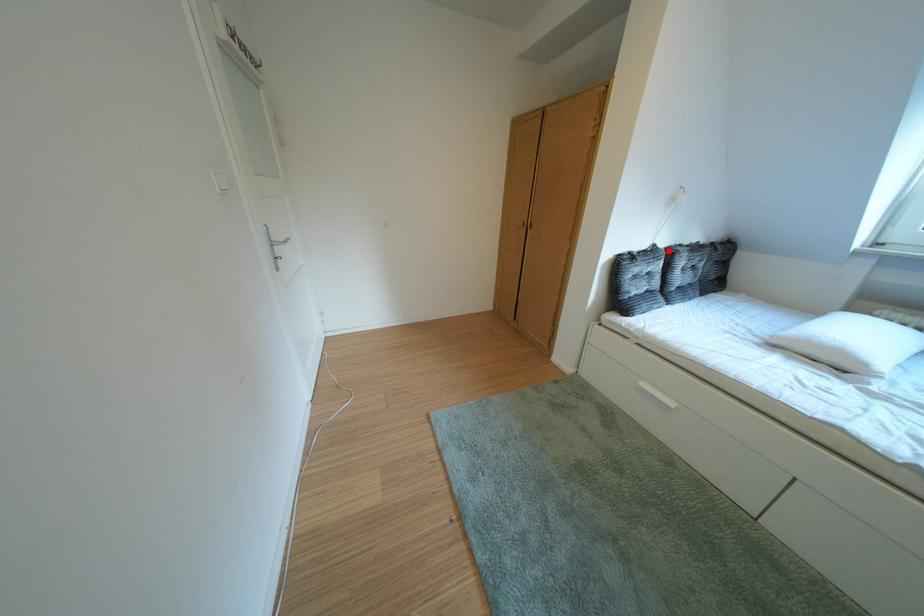
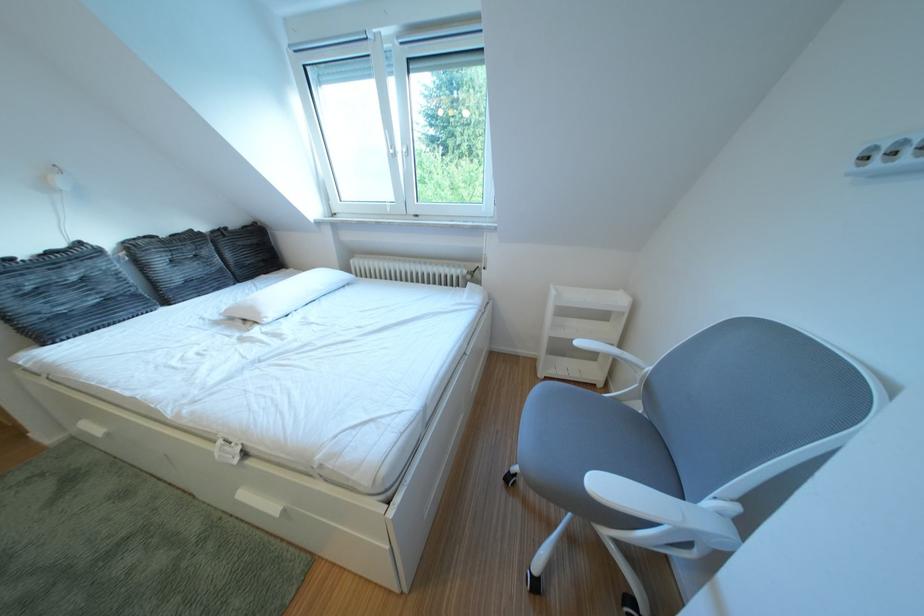
The point at the highlighted location is marked in the first image. Where is the corresponding point in the second image?

(93, 249)